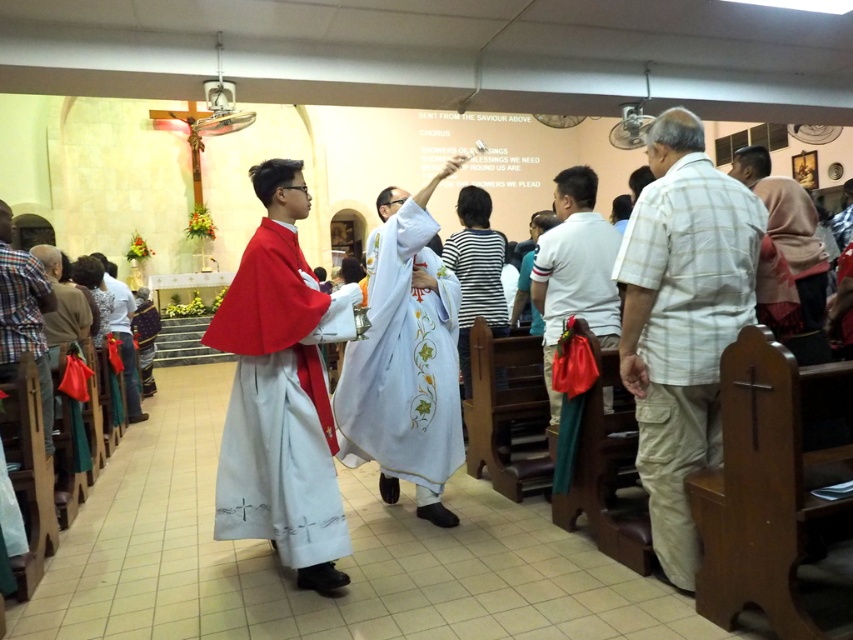
You are a photographer trying to capture a photo of the white embroidered robe at center and the plaid cotton shirt at lower left. If you want to ensure both are fully visible in the frame, which object should you focus on to avoid cropping?

You should focus on the white embroidered robe at center because it might be wider than the plaid cotton shirt at lower left, so centering it would ensure both are visible.